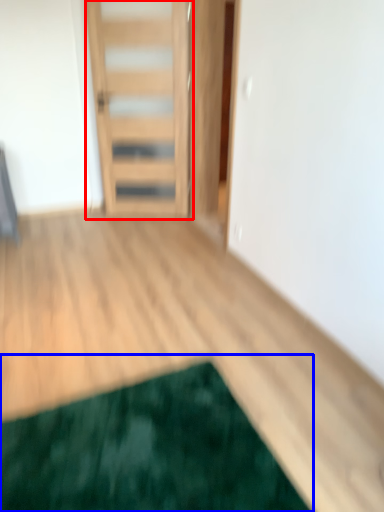
Question: Among these objects, which one is nearest to the camera, door (highlighted by a red box) or mat (highlighted by a blue box)?

Choices:
 (A) door
 (B) mat

Answer: (B)